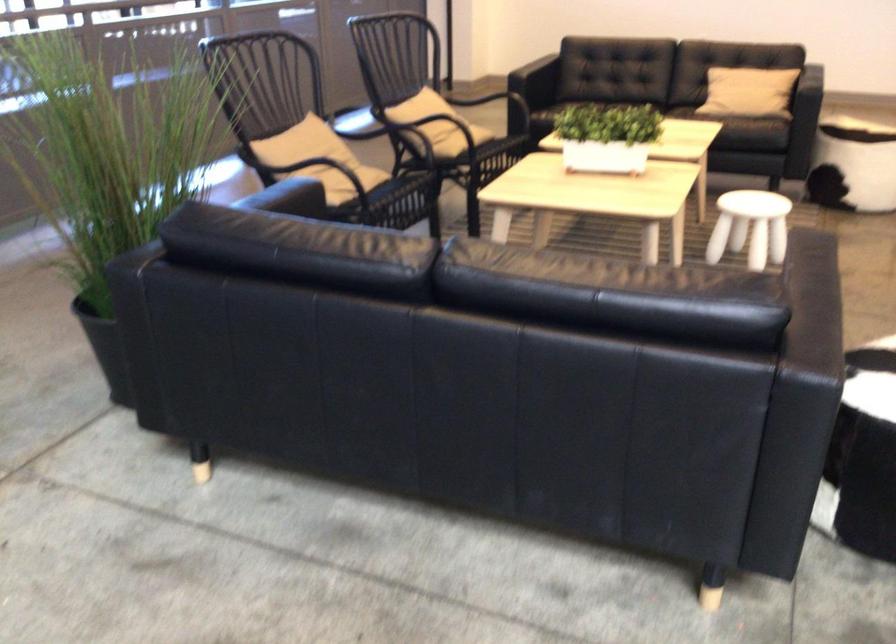
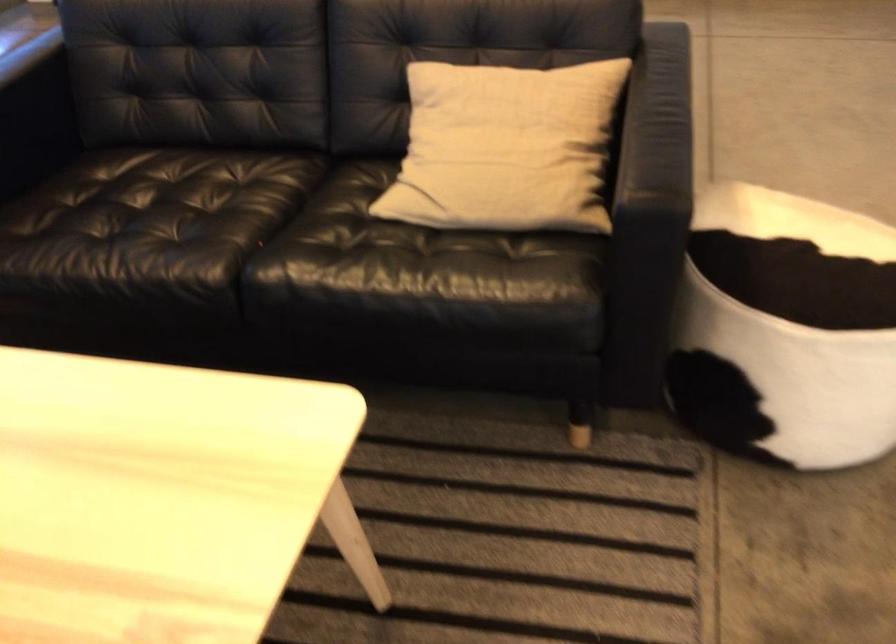
What movement of the cameraman would produce the second image?

The movement direction of the cameraman is right, forward.